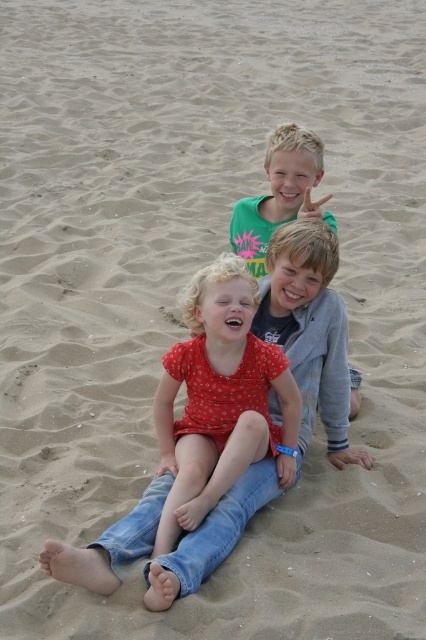
Does red dotted shirt at center appear on the left side of green cotton shirt at upper center?

Indeed, red dotted shirt at center is positioned on the left side of green cotton shirt at upper center.

Is the position of red dotted shirt at center less distant than that of green cotton shirt at upper center?

Yes, red dotted shirt at center is closer to the viewer.

At what (x,y) coordinates should I click in order to perform the action: click on red dotted shirt at center. Please return your answer as a coordinate pair (x, y). The image size is (426, 640). Looking at the image, I should click on (219, 400).